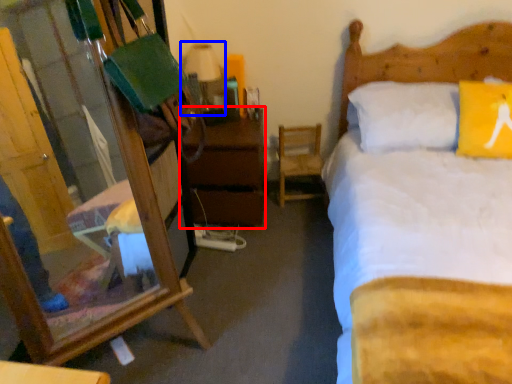
Question: Which object appears closest to the camera in this image, nightstand (highlighted by a red box) or table lamp (highlighted by a blue box)?

Choices:
 (A) nightstand
 (B) table lamp

Answer: (A)